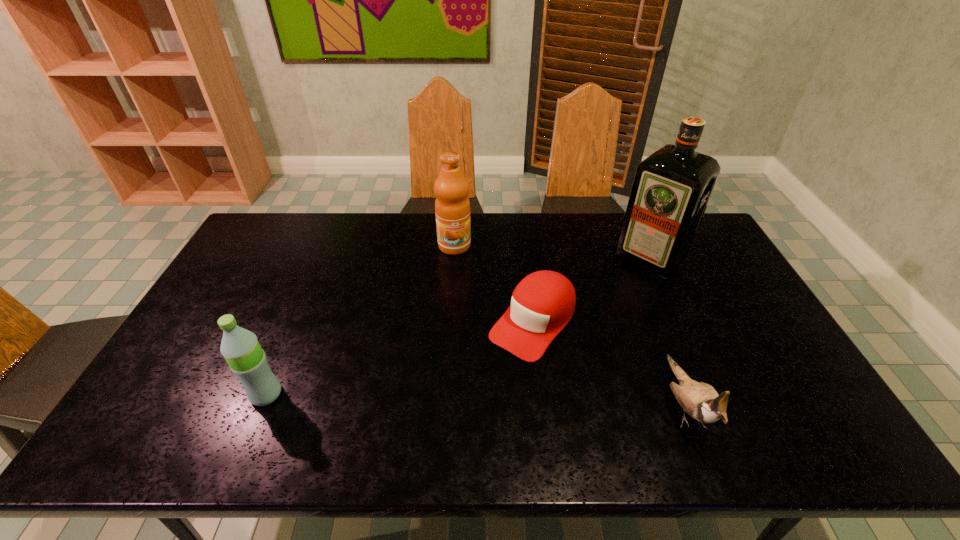
Find the location of a particular element. free point between the fourth tallest object and the tallest object is located at coordinates (666, 330).

Identify the location of vacant point located between the liquor and the second tallest object. (552, 252).

I want to click on free space between the bird and the fourth object from right to left, so click(x=569, y=324).

Identify the location of vacant space in between the fourth tallest object and the tallest object. (666, 330).

In order to click on blank region between the shortest object and the bird in this screenshot , I will do `click(608, 362)`.

What are the coordinates of `free space between the tallest object and the water bottle` in the screenshot? It's located at (458, 326).

Image resolution: width=960 pixels, height=540 pixels. What are the coordinates of `unoccupied position between the third tallest object and the second object from left to right` in the screenshot? It's located at (360, 320).

Locate an element on the screen. The height and width of the screenshot is (540, 960). free space between the shortest object and the third tallest object is located at coordinates (399, 359).

Identify which object is the second nearest to the fourth tallest object. Please provide its 2D coordinates. Your answer should be formatted as a tuple, i.e. [(x, y)], where the tuple contains the x and y coordinates of a point satisfying the conditions above.

[(671, 189)]

Locate which object is the closest to the third tallest object. Please provide its 2D coordinates. Your answer should be formatted as a tuple, i.e. [(x, y)], where the tuple contains the x and y coordinates of a point satisfying the conditions above.

[(542, 304)]